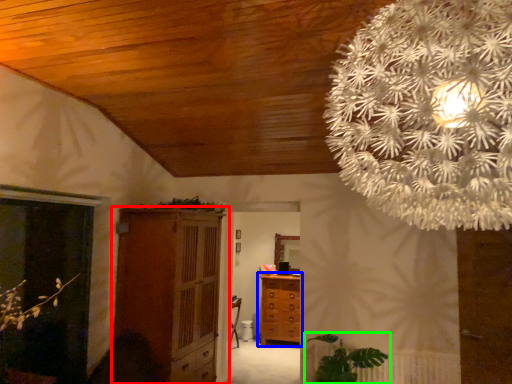
Question: Based on their relative distances, which object is farther from cupboard (highlighted by a red box)? Choose from chest of drawers (highlighted by a blue box) and houseplant (highlighted by a green box).

Choices:
 (A) chest of drawers
 (B) houseplant

Answer: (A)